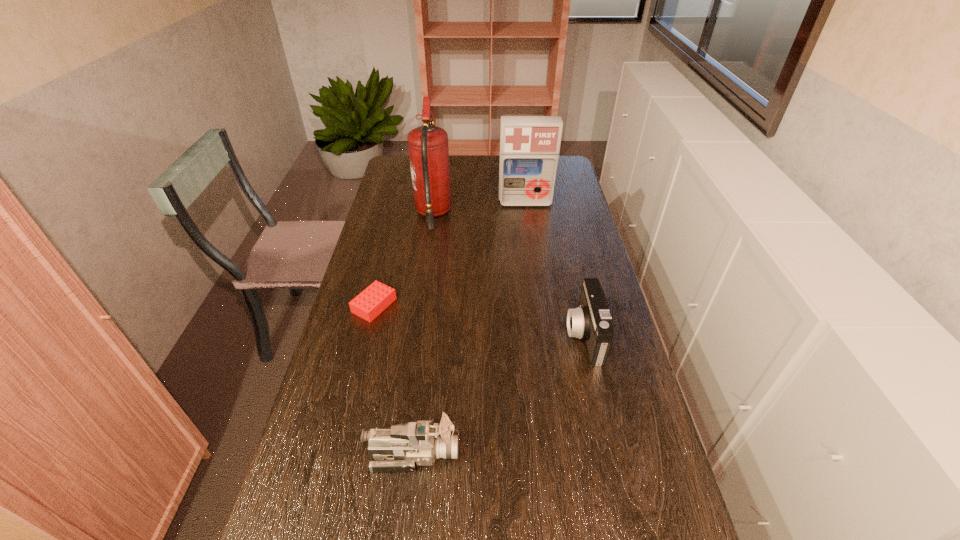
Image resolution: width=960 pixels, height=540 pixels. In the image, there is a desktop. Find the location of `free region at the left edge`. free region at the left edge is located at coordinates (356, 402).

The height and width of the screenshot is (540, 960). I want to click on vacant region at the right edge of the desktop, so click(591, 383).

Locate an element on the screen. This screenshot has height=540, width=960. free space between the right camcorder and the tallest object is located at coordinates (509, 275).

Locate an element on the screen. This screenshot has height=540, width=960. blank region between the fire extinguisher and the first-aid kit is located at coordinates (479, 208).

Image resolution: width=960 pixels, height=540 pixels. I want to click on vacant area that lies between the Lego and the first-aid kit, so click(x=450, y=254).

The width and height of the screenshot is (960, 540). In order to click on unoccupied position between the right camcorder and the nearest object in this screenshot , I will do `click(498, 395)`.

Image resolution: width=960 pixels, height=540 pixels. Identify the location of free space between the nearer camcorder and the fourth shortest object. (469, 328).

Locate an element on the screen. Image resolution: width=960 pixels, height=540 pixels. unoccupied area between the Lego and the fire extinguisher is located at coordinates (403, 260).

At what (x,y) coordinates should I click in order to perform the action: click on blank region between the fourth shortest object and the left camcorder. Please return your answer as a coordinate pair (x, y). Image resolution: width=960 pixels, height=540 pixels. Looking at the image, I should click on (469, 328).

What are the coordinates of `free area in between the nearest object and the second tallest object` in the screenshot? It's located at (469, 328).